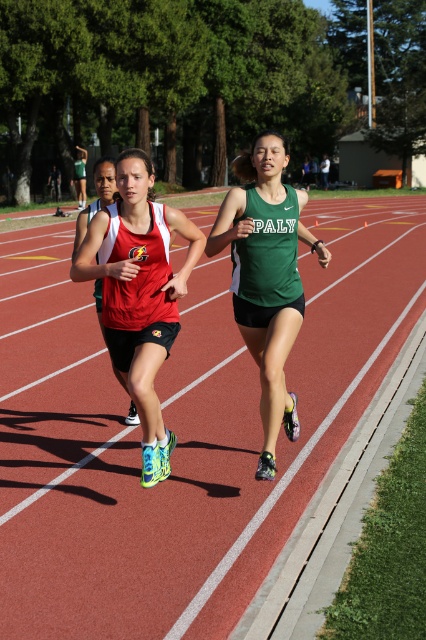
Question: Does red rubber track at center have a greater width compared to matte red tank top at center?

Choices:
 (A) yes
 (B) no

Answer: (A)

Question: Is red rubber track at center bigger than matte red tank top at center?

Choices:
 (A) yes
 (B) no

Answer: (A)

Question: Which object appears closest to the camera in this image?

Choices:
 (A) green matte tank top at center
 (B) matte red tank top at center

Answer: (B)

Question: Observing the image, what is the correct spatial positioning of red rubber track at center in reference to green matte tank top at center?

Choices:
 (A) left
 (B) right

Answer: (A)

Question: Which object is positioned closest to the green matte tank top at center?

Choices:
 (A) red rubber track at center
 (B) matte red tank top at center

Answer: (B)

Question: Which object appears closest to the camera in this image?

Choices:
 (A) green matte tank top at center
 (B) matte red tank top at center
 (C) red rubber track at center

Answer: (C)